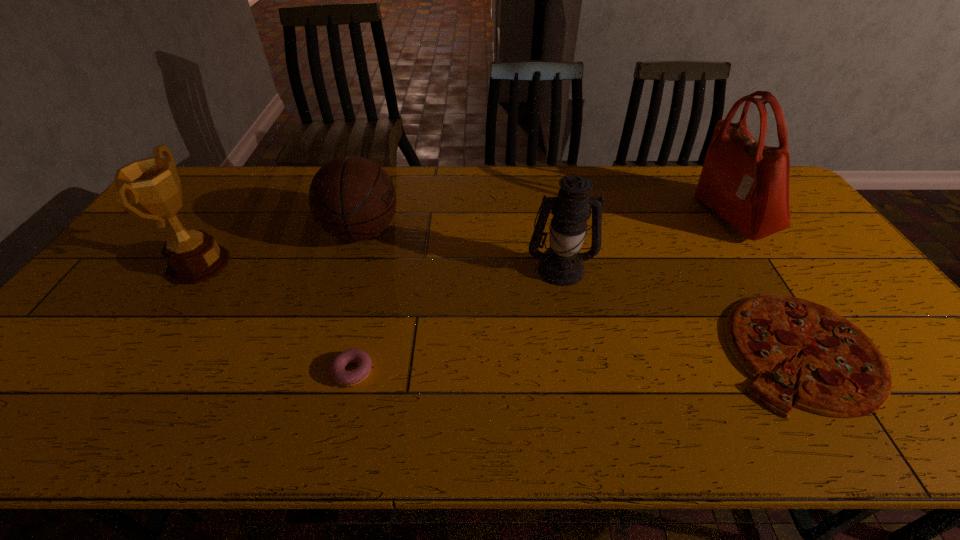
Where is `vacant space positioned on the back of the third object from right to left`? vacant space positioned on the back of the third object from right to left is located at coordinates (545, 186).

Where is `vacant space situated on the side with brand label of the basketball`? The image size is (960, 540). vacant space situated on the side with brand label of the basketball is located at coordinates (449, 232).

The image size is (960, 540). Identify the location of free space located on the right of the doughnut. (447, 371).

The image size is (960, 540). Find the location of `free space located on the back of the pizza`. free space located on the back of the pizza is located at coordinates (739, 252).

I want to click on object that is at the far edge, so click(746, 183).

Find the location of a particular element. The width and height of the screenshot is (960, 540). object that is at the near edge is located at coordinates (843, 374).

Image resolution: width=960 pixels, height=540 pixels. In order to click on object at the left edge in this screenshot , I will do coord(152,184).

Image resolution: width=960 pixels, height=540 pixels. I want to click on handbag located at the right edge, so 746,183.

Where is `pizza located at the right edge`? pizza located at the right edge is located at coordinates (843, 374).

Image resolution: width=960 pixels, height=540 pixels. Identify the location of object at the far right corner. (746, 183).